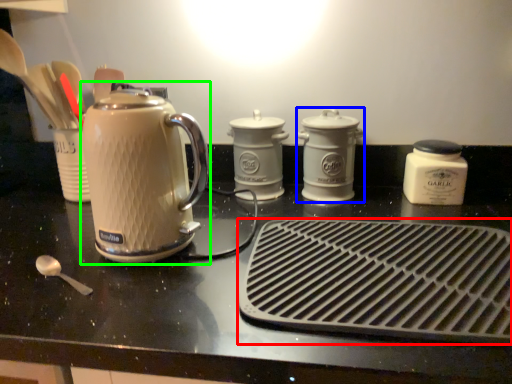
Question: Considering the real-world distances, which object is closest to kitchen appliance (highlighted by a red box)? kitchen appliance (highlighted by a blue box) or kettle (highlighted by a green box).

Choices:
 (A) kitchen appliance
 (B) kettle

Answer: (B)